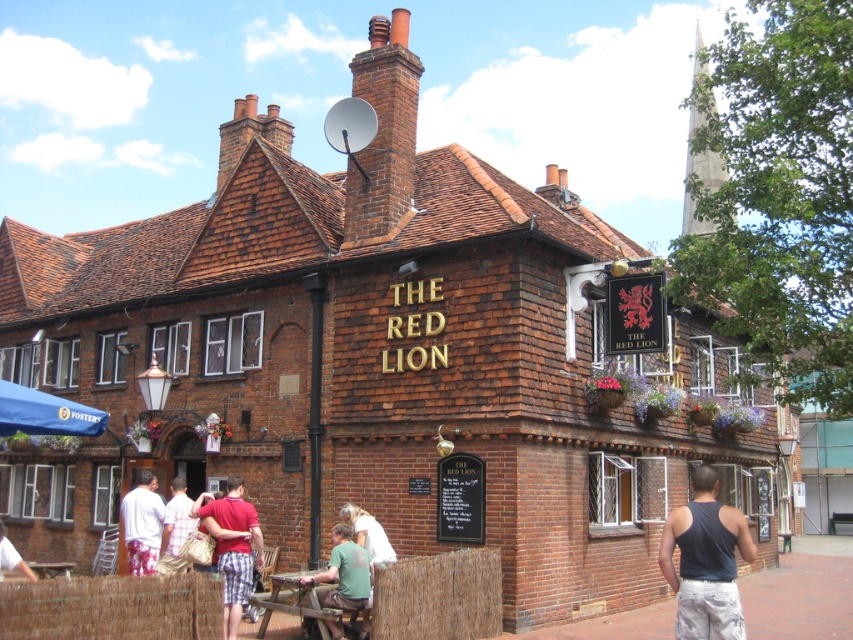
Question: Estimate the real-world distances between objects in this image. Which object is closer to the green cotton shirt at lower center?

Choices:
 (A) white cotton shirt at center
 (B) plaid shorts at center
 (C) dark blue tank top at center
 (D) light green fabric shirt at center

Answer: (D)

Question: Can you confirm if white cotton shirt at center is positioned to the left of light green fabric shirt at center?

Choices:
 (A) yes
 (B) no

Answer: (A)

Question: Which object is positioned farthest from the green cotton shirt at lower center?

Choices:
 (A) white cotton shirt at center
 (B) white cotton shirt at lower left

Answer: (B)

Question: Which object appears farthest from the camera in this image?

Choices:
 (A) plaid shorts at center
 (B) white cotton shirt at lower left
 (C) light green fabric shirt at center
 (D) dark blue tank top at center

Answer: (C)

Question: Can you confirm if dark blue tank top at center is positioned to the left of light green fabric shirt at center?

Choices:
 (A) yes
 (B) no

Answer: (B)

Question: Is green cotton shirt at lower center further to camera compared to light green fabric shirt at center?

Choices:
 (A) yes
 (B) no

Answer: (B)